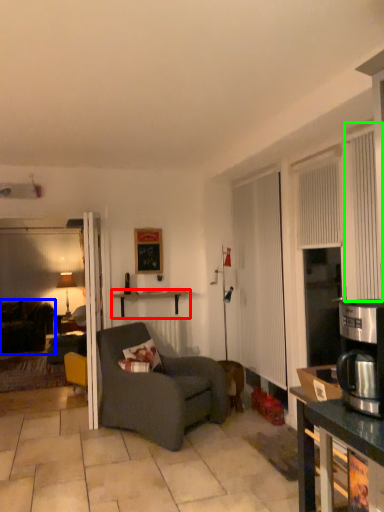
Question: Estimate the real-world distances between objects in this image. Which object is closer to desk (highlighted by a red box), studio couch (highlighted by a blue box) or curtain (highlighted by a green box)?

Choices:
 (A) studio couch
 (B) curtain

Answer: (A)